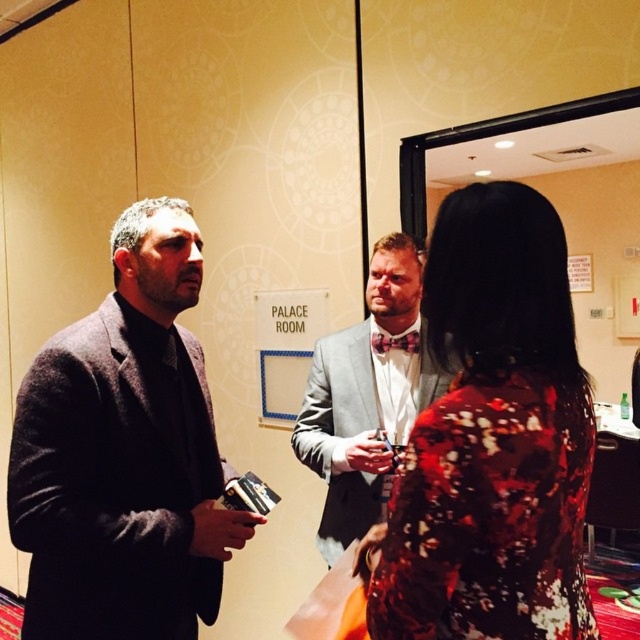
Can you confirm if dark wool suit at left is positioned to the left of shiny red bow tie at center?

Yes, dark wool suit at left is to the left of shiny red bow tie at center.

Describe the element at coordinates (124, 452) in the screenshot. I see `dark wool suit at left` at that location.

Where is `dark wool suit at left`? The image size is (640, 640). dark wool suit at left is located at coordinates (124, 452).

Does dark wool suit at left appear over silver metallic suit at center?

No.

Can you confirm if dark wool suit at left is positioned to the left of silver metallic suit at center?

Indeed, dark wool suit at left is positioned on the left side of silver metallic suit at center.

Is point (100, 381) in front of point (342, 497)?

Yes, it is.

Locate an element on the screen. This screenshot has width=640, height=640. dark wool suit at left is located at coordinates (124, 452).

In the scene shown: Between floral dress at center and dark wool suit at left, which one appears on the right side from the viewer's perspective?

floral dress at center

Does floral dress at center have a lesser width compared to dark wool suit at left?

Correct, floral dress at center's width is less than dark wool suit at left's.

At what (x,y) coordinates should I click in order to perform the action: click on floral dress at center. Please return your answer as a coordinate pair (x, y). The width and height of the screenshot is (640, 640). Looking at the image, I should click on (492, 440).